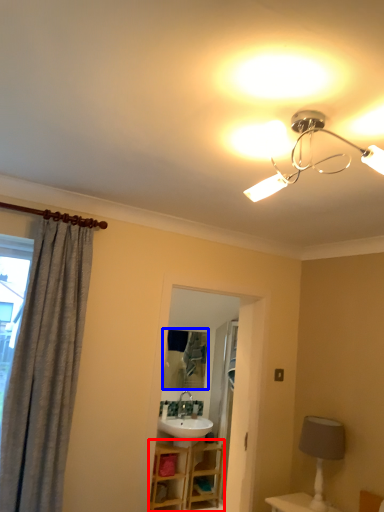
Question: Among these objects, which one is farthest to the camera, vanity (highlighted by a red box) or mirror (highlighted by a blue box)?

Choices:
 (A) vanity
 (B) mirror

Answer: (B)